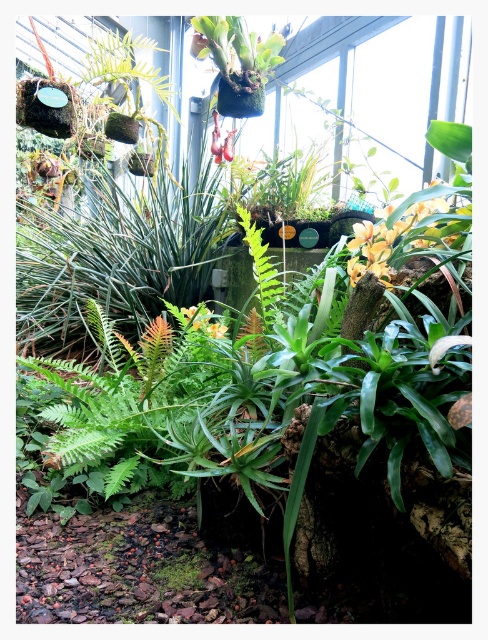
Is point (354, 248) positioned behind point (208, 326)?

No.

Does yellow-green textured flower at center-right have a smaller size compared to yellow matte flower at center?

Incorrect, yellow-green textured flower at center-right is not smaller in size than yellow matte flower at center.

What are the coordinates of `yellow-green textured flower at center-right` in the screenshot? It's located at coord(394,236).

Where is `yellow-green textured flower at center-right`? The image size is (488, 640). yellow-green textured flower at center-right is located at coordinates (394, 236).